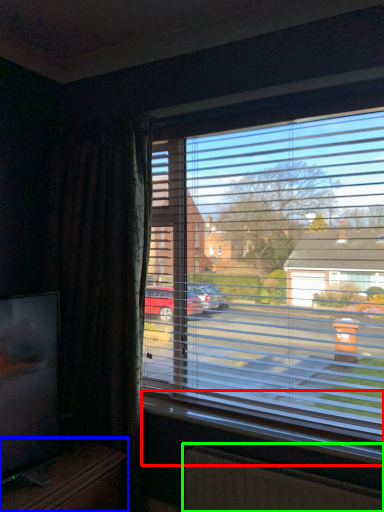
Question: Which is nearer to the window sill (highlighted by a red box)? entertainment center (highlighted by a blue box) or radiator (highlighted by a green box).

Choices:
 (A) entertainment center
 (B) radiator

Answer: (B)